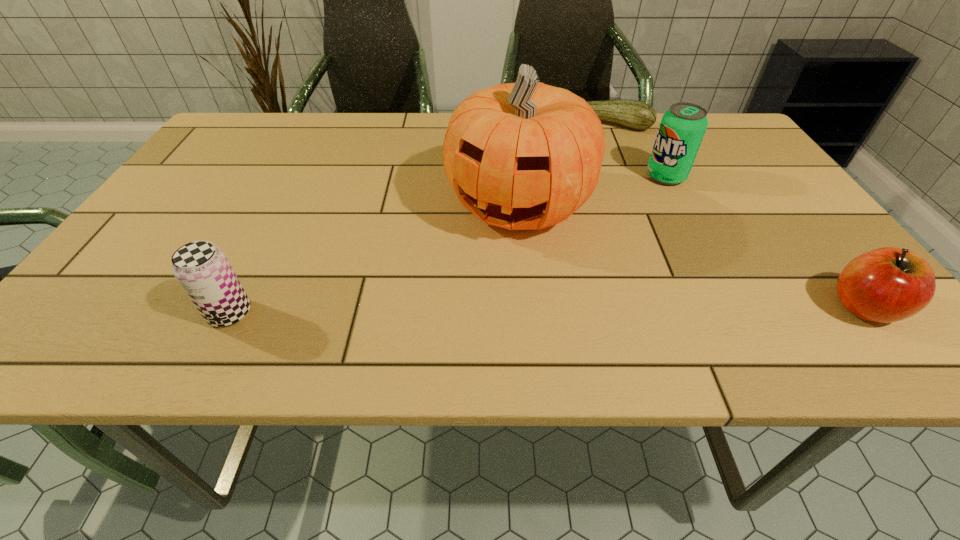
At what (x,y) coordinates should I click in order to perform the action: click on object positioned at the right edge. Please return your answer as a coordinate pair (x, y). Looking at the image, I should click on (884, 285).

At what (x,y) coordinates should I click in order to perform the action: click on object that is at the near right corner. Please return your answer as a coordinate pair (x, y). Looking at the image, I should click on (884, 285).

The image size is (960, 540). Find the location of `free space at the far edge of the desktop`. free space at the far edge of the desktop is located at coordinates (310, 129).

Where is `free space at the near edge of the desktop`? The height and width of the screenshot is (540, 960). free space at the near edge of the desktop is located at coordinates (533, 283).

This screenshot has height=540, width=960. Find the location of `blank area at the left edge`. blank area at the left edge is located at coordinates (219, 194).

Identify the location of free space at the right edge. This screenshot has height=540, width=960. (757, 159).

Locate an element on the screen. This screenshot has width=960, height=540. vacant space at the far right corner of the desktop is located at coordinates (735, 143).

Find the location of a particular element. The width and height of the screenshot is (960, 540). free point between the pumpkin and the rightmost object is located at coordinates (691, 256).

Image resolution: width=960 pixels, height=540 pixels. I want to click on free space between the rightmost object and the pumpkin, so click(x=691, y=256).

I want to click on vacant space that's between the shortest object and the pop soda, so click(636, 151).